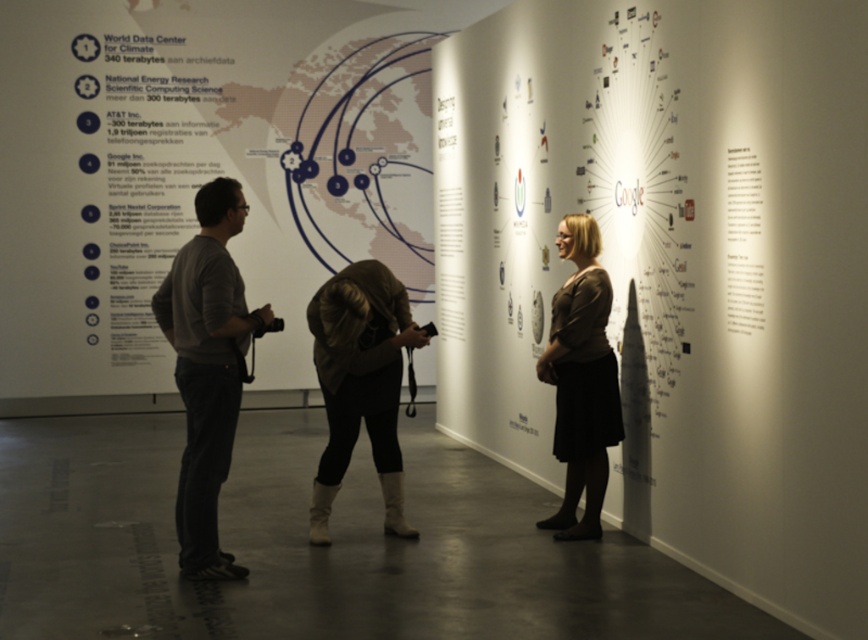
Based on the photo, does leather boots at center appear over dark brown sweater at center?

Actually, leather boots at center is below dark brown sweater at center.

Is point (413, 339) farther from camera compared to point (549, 380)?

No.

I want to click on leather boots at center, so click(x=360, y=381).

Is gray cotton shirt at center closer to the viewer compared to dark brown sweater at center?

Yes, gray cotton shirt at center is closer to the viewer.

What do you see at coordinates (207, 369) in the screenshot?
I see `gray cotton shirt at center` at bounding box center [207, 369].

Which is in front, point (189, 502) or point (540, 524)?

Point (189, 502) is in front.

Image resolution: width=868 pixels, height=640 pixels. I want to click on gray cotton shirt at center, so click(x=207, y=369).

Is gray cotton shirt at center behind leather boots at center?

No, gray cotton shirt at center is in front of leather boots at center.

Between point (222, 333) and point (365, 387), which one is positioned in front?

Point (222, 333)

Is point (169, 307) more distant than point (365, 284)?

No, (169, 307) is closer to viewer.

This screenshot has height=640, width=868. Find the location of `gray cotton shirt at center`. gray cotton shirt at center is located at coordinates (207, 369).